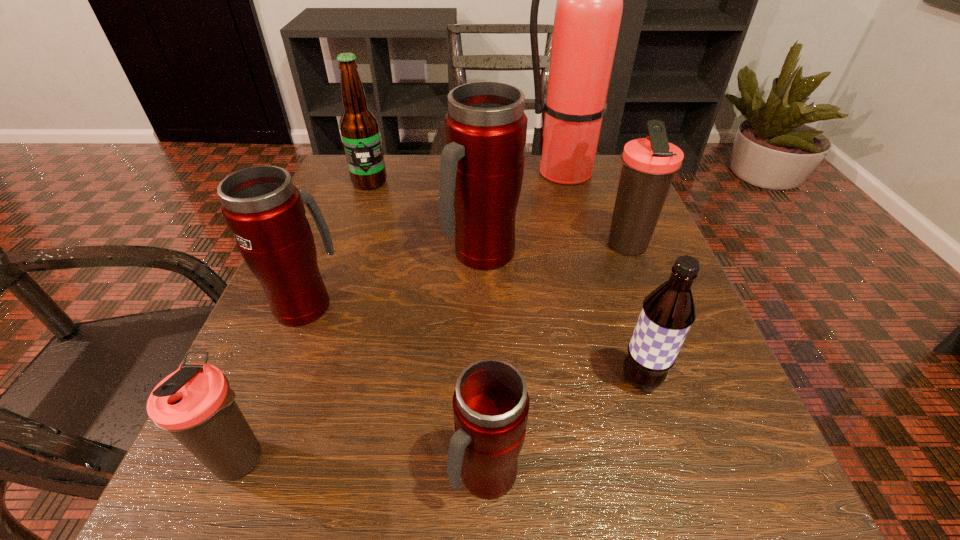
This screenshot has height=540, width=960. I want to click on thermos bottle that can be found as the fourth closest to the smaller brown thermos bottle, so click(649, 164).

Choose which thermos bottle is the fourth nearest neighbor to the smallest red thermos bottle. Please provide its 2D coordinates. Your answer should be formatted as a tuple, i.e. [(x, y)], where the tuple contains the x and y coordinates of a point satisfying the conditions above.

[(649, 164)]

Identify which red thermos bottle is the second nearest to the fire extinguisher. Please provide its 2D coordinates. Your answer should be formatted as a tuple, i.e. [(x, y)], where the tuple contains the x and y coordinates of a point satisfying the conditions above.

[(264, 210)]

Find the location of a particular element. The height and width of the screenshot is (540, 960). the second closest red thermos bottle to the farthest red thermos bottle is located at coordinates (490, 403).

I want to click on free spot that satisfies the following two spatial constraints: 1. on the side with the handle of the third nearest object; 2. on the right side of the farthest red thermos bottle, so click(483, 379).

Image resolution: width=960 pixels, height=540 pixels. What are the coordinates of `vacant area in the image that satisfies the following two spatial constraints: 1. on the back side of the rightmost thermos bottle; 2. on the right side of the smaller brown thermos bottle` in the screenshot? It's located at (327, 246).